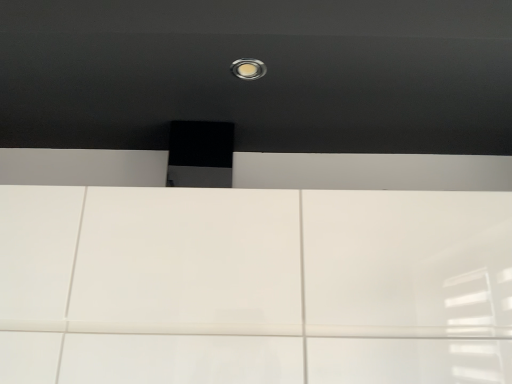
Describe the element at coordinates (248, 69) in the screenshot. The width and height of the screenshot is (512, 384). I see `matte silver droplight at upper center` at that location.

What is the approximate height of matte silver droplight at upper center?

0.52 inches.

In order to click on matte silver droplight at upper center in this screenshot , I will do `click(248, 69)`.

Image resolution: width=512 pixels, height=384 pixels. I want to click on matte silver droplight at upper center, so click(248, 69).